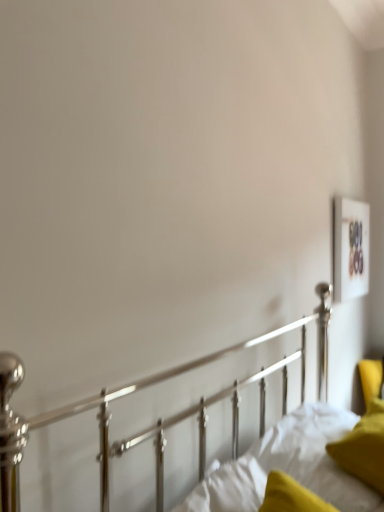
Question: From the image's perspective, is white soft mattress at lower right located above velvet yellow pillow at lower right?

Choices:
 (A) yes
 (B) no

Answer: (B)

Question: From the image's perspective, does white soft mattress at lower right appear lower than velvet yellow pillow at lower right?

Choices:
 (A) yes
 (B) no

Answer: (A)

Question: Is white soft mattress at lower right to the left of velvet yellow pillow at lower right from the viewer's perspective?

Choices:
 (A) no
 (B) yes

Answer: (B)

Question: Would you say white soft mattress at lower right is a long distance from velvet yellow pillow at lower right?

Choices:
 (A) no
 (B) yes

Answer: (A)

Question: Is white soft mattress at lower right wider than velvet yellow pillow at lower right?

Choices:
 (A) yes
 (B) no

Answer: (A)

Question: In the image, is wooden frame at upper right on the left side or the right side of white soft mattress at lower right?

Choices:
 (A) left
 (B) right

Answer: (B)

Question: Is wooden frame at upper right wider or thinner than white soft mattress at lower right?

Choices:
 (A) thin
 (B) wide

Answer: (A)

Question: Does point (347, 241) appear closer or farther from the camera than point (266, 451)?

Choices:
 (A) closer
 (B) farther

Answer: (B)

Question: Considering their positions, is wooden frame at upper right located in front of or behind white soft mattress at lower right?

Choices:
 (A) front
 (B) behind

Answer: (B)

Question: From the image's perspective, is white soft mattress at lower right positioned above or below velvet yellow pillow at lower right?

Choices:
 (A) below
 (B) above

Answer: (A)

Question: Is white soft mattress at lower right in front of or behind velvet yellow pillow at lower right in the image?

Choices:
 (A) front
 (B) behind

Answer: (A)

Question: Is point (288, 434) positioned closer to the camera than point (360, 417)?

Choices:
 (A) farther
 (B) closer

Answer: (B)

Question: From a real-world perspective, is white soft mattress at lower right physically located above or below velvet yellow pillow at lower right?

Choices:
 (A) above
 (B) below

Answer: (B)

Question: In the image, is wooden frame at upper right positioned in front of or behind velvet yellow pillow at lower right?

Choices:
 (A) behind
 (B) front

Answer: (A)

Question: From a real-world perspective, is wooden frame at upper right physically located above or below velvet yellow pillow at lower right?

Choices:
 (A) above
 (B) below

Answer: (A)